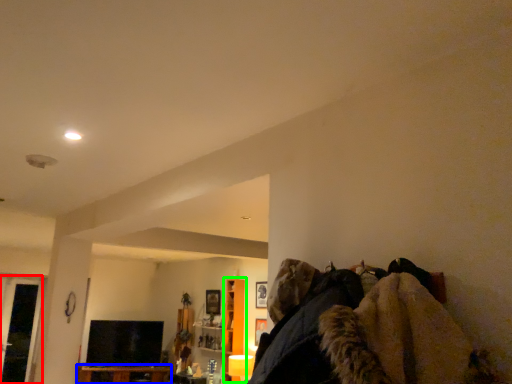
Question: Based on their relative distances, which object is nearer to glass door (highlighted by a red box)? Choose from furniture (highlighted by a blue box) and cabinet (highlighted by a green box).

Choices:
 (A) furniture
 (B) cabinet

Answer: (A)